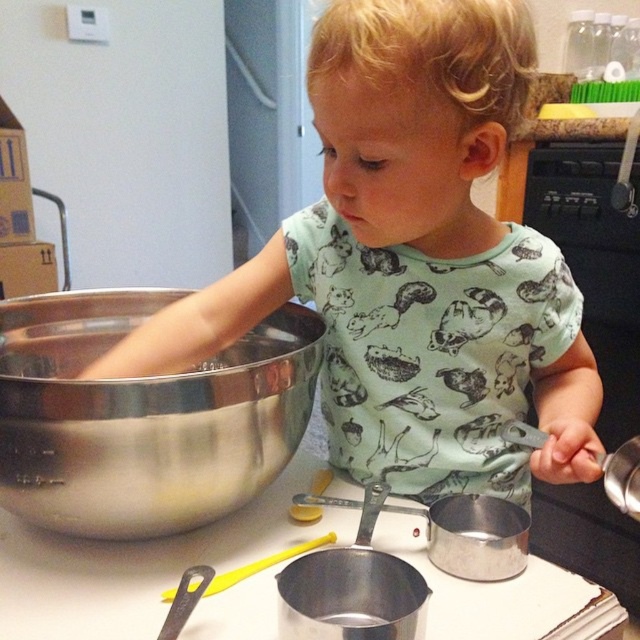
You are a chef observing a child in the kitchen. The child is wearing a green printed shirt at center and has a shiny metallic bowl at center nearby. From your perspective, is the bowl located in front of or behind the shirt?

The shiny metallic bowl at center is behind the green printed shirt at center, so from your perspective, the bowl is located behind the shirt.

From the picture: You are a chef observing a child in the kitchen. The child is wearing a green printed shirt at center and holding a shiny metallic bowl at center. From your perspective, which object is taller?

The green printed shirt at center is taller than the shiny metallic bowl at center.

The child is wearing a green printed shirt at center and holding a shiny metallic bowl at center. Which item is wider?

The green printed shirt at center is wider than the shiny metallic bowl at center according to the description.